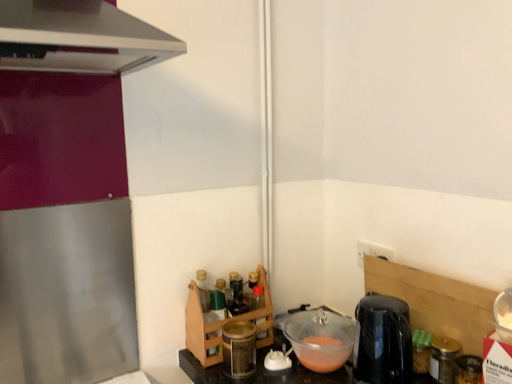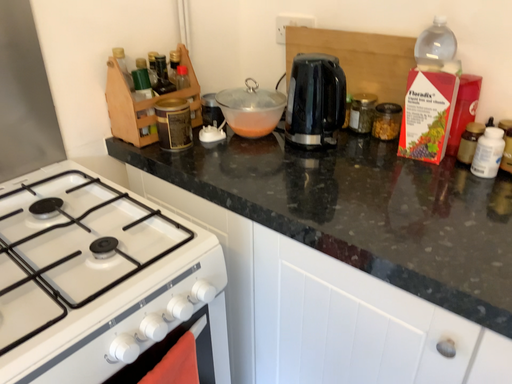
Question: Which way did the camera rotate in the video?

Choices:
 (A) rotated left
 (B) rotated right

Answer: (B)